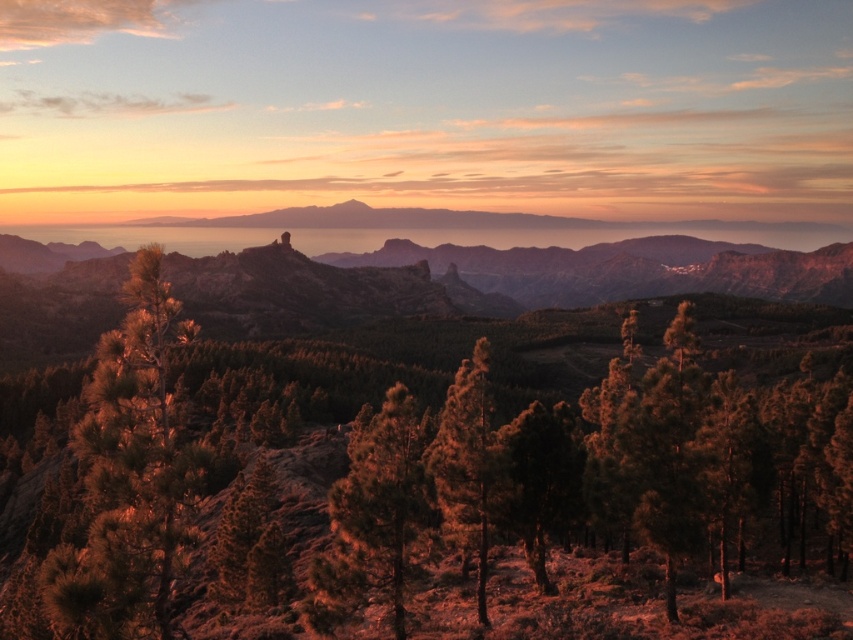
Which is behind, point (598, 301) or point (434, 442)?

The point (598, 301) is more distant.

Is point (30, 268) positioned in front of point (474, 445)?

No, (30, 268) is further to viewer.

Between point (833, 292) and point (463, 397), which one is positioned behind?

Point (833, 292)

Where is `brown rocky mountain range at center`? This screenshot has height=640, width=853. brown rocky mountain range at center is located at coordinates [544, 272].

Does green textured pine tree at left come behind green matte tree at center?

No, it is in front of green matte tree at center.

Describe the element at coordinates (131, 474) in the screenshot. I see `green textured pine tree at left` at that location.

What are the coordinates of `green textured pine tree at left` in the screenshot? It's located at (131, 474).

The height and width of the screenshot is (640, 853). I want to click on green textured pine tree at left, so click(x=131, y=474).

Does green matte tree at center have a greater height compared to green textured tree at center?

Yes.

Which of these two, green matte tree at center or green textured tree at center, stands shorter?

Standing shorter between the two is green textured tree at center.

Who is more forward, (416, 502) or (485, 576)?

Point (416, 502) is in front.

You are a GUI agent. You are given a task and a screenshot of the screen. Output one action in this format:
    pyautogui.click(x=<x>, y=<y>)
    Task: Click on the green matte tree at center
    
    Given the screenshot: What is the action you would take?
    pyautogui.click(x=374, y=512)